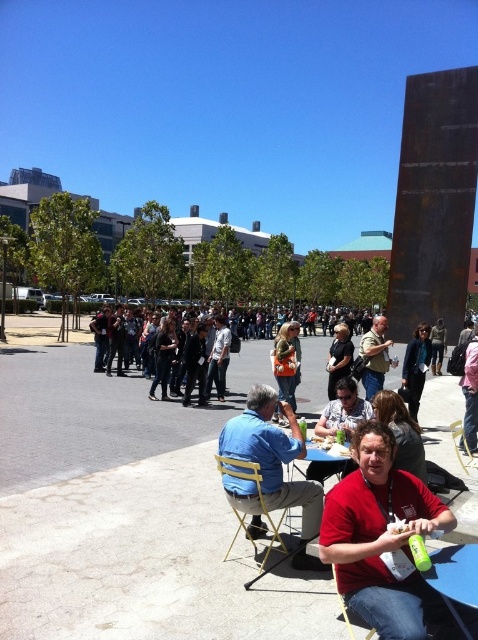
Question: Based on their relative distances, which object is farther from the gold metallic chair at center?

Choices:
 (A) matte black jacket at center
 (B) orange fabric purse at center
 (C) blue plastic table at center
 (D) yellow plastic chair at lower center

Answer: (B)

Question: In this image, where is matte black jacket at center located relative to dark gray shirt at center?

Choices:
 (A) right
 (B) left

Answer: (B)

Question: Which point is farther from the camera taking this photo?

Choices:
 (A) (278, 369)
 (B) (358, 572)
 (C) (474, 547)
 (D) (451, 426)

Answer: (A)

Question: Does matte black jacket at center have a greater width compared to yellow plastic chair at lower center?

Choices:
 (A) yes
 (B) no

Answer: (A)

Question: Which of these objects is positioned closest to the matte black jacket at center?

Choices:
 (A) blue plastic table at center
 (B) dark gray shirt at center
 (C) dark blue suit at center
 (D) yellow plastic chair at lower center

Answer: (A)

Question: Is blue denim shirt at center behind dark gray shirt at center?

Choices:
 (A) yes
 (B) no

Answer: (B)